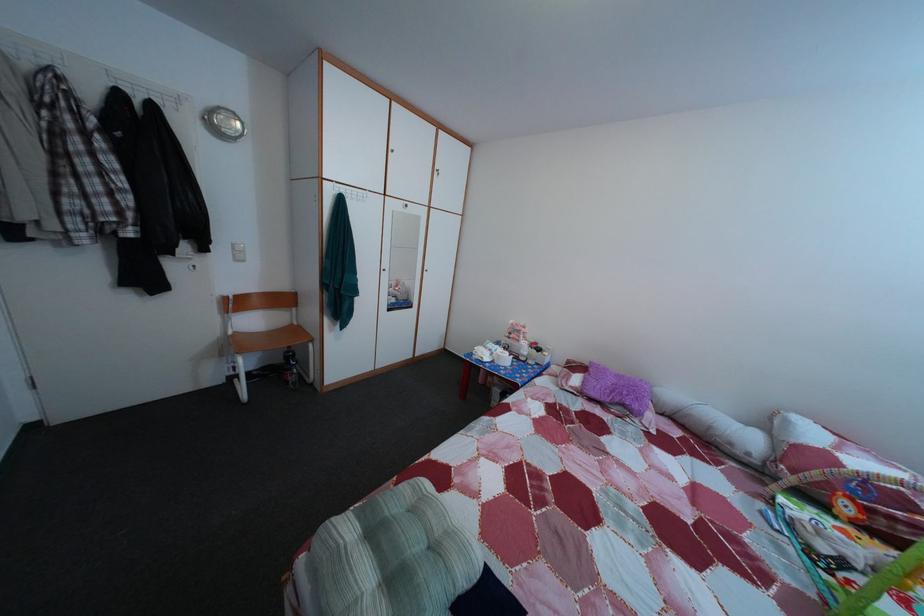
Identify the location of white wall hook. (237, 252).